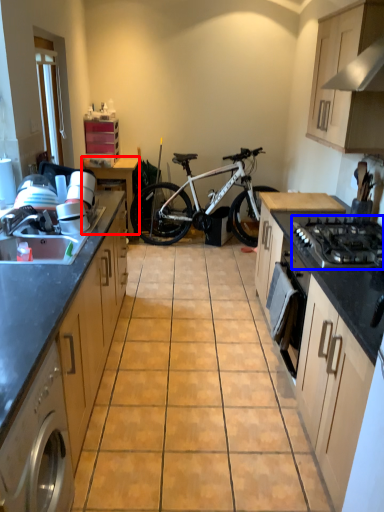
Question: Which object appears closest to the camera in this image, table (highlighted by a red box) or gas stove (highlighted by a blue box)?

Choices:
 (A) table
 (B) gas stove

Answer: (B)